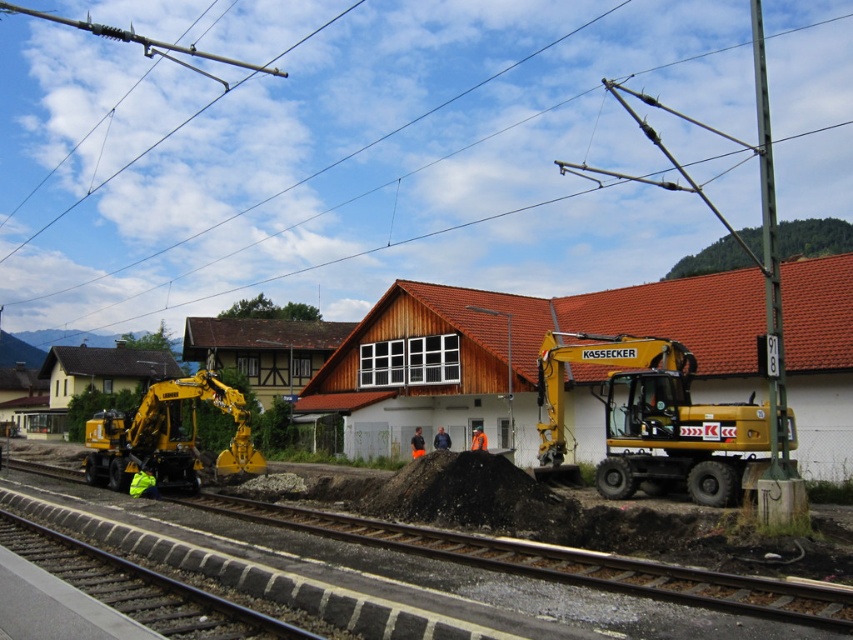
Measure the distance between point (662,460) and camera.

The distance of point (662,460) from camera is 19.40 meters.

Can you confirm if yellow metallic excavator at right is thinner than gray gravel train track at lower left?

Result: Indeed, yellow metallic excavator at right has a lesser width compared to gray gravel train track at lower left.

Is point (758, 412) behind point (242, 634)?

Yes.

The image size is (853, 640). In order to click on yellow metallic excavator at right in this screenshot , I will do `click(653, 420)`.

Is yellow metallic excavator at right wider than smooth asphalt track at lower left?

No.

Is yellow metallic excavator at right below smooth asphalt track at lower left?

Actually, yellow metallic excavator at right is above smooth asphalt track at lower left.

Find the location of `yellow metallic excavator at right`. yellow metallic excavator at right is located at coordinates (653, 420).

Where is `yellow metallic excavator at right`? The height and width of the screenshot is (640, 853). yellow metallic excavator at right is located at coordinates (653, 420).

Does smooth asphalt track at lower left appear on the left side of gray gravel train track at lower left?

Correct, you'll find smooth asphalt track at lower left to the left of gray gravel train track at lower left.

Does smooth asphalt track at lower left have a lesser width compared to gray gravel train track at lower left?

Incorrect, smooth asphalt track at lower left's width is not less than gray gravel train track at lower left's.

Is point (850, 600) farther from viewer compared to point (126, 596)?

No, it is in front of (126, 596).

At what (x,y) coordinates should I click in order to perform the action: click on smooth asphalt track at lower left. Please return your answer as a coordinate pair (x, y). This screenshot has height=640, width=853. Looking at the image, I should click on (549, 563).